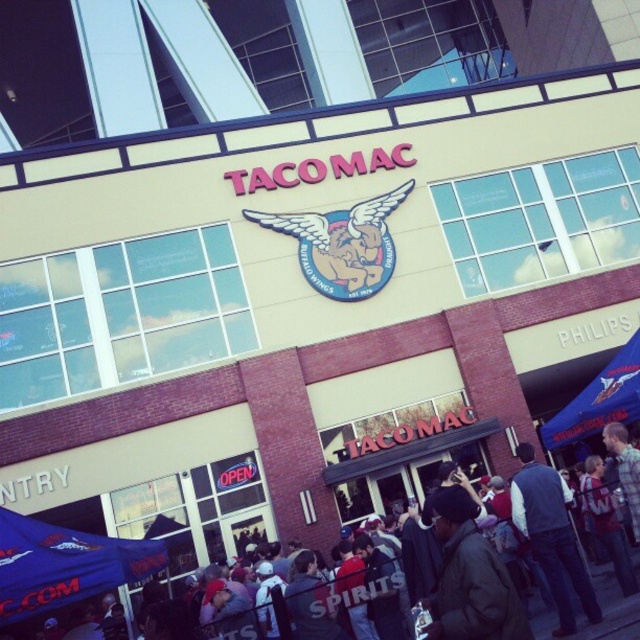
Does blue fabric canopy at lower left appear on the right side of dark gray jacket at center?

In fact, blue fabric canopy at lower left is to the left of dark gray jacket at center.

Who is positioned more to the right, blue fabric canopy at lower left or dark gray jacket at center?

dark gray jacket at center

Who is more forward, (109, 556) or (602, 632)?

Point (602, 632) is more forward.

I want to click on blue fabric canopy at lower left, so click(x=65, y=564).

Where is `blue fabric canopy at lower left`? The height and width of the screenshot is (640, 640). blue fabric canopy at lower left is located at coordinates (65, 564).

Does point (29, 563) come in front of point (528, 467)?

Yes, it is in front of point (528, 467).

Identify the location of blue fabric canopy at lower left. (65, 564).

Between point (60, 566) and point (529, 628), which one is positioned behind?

The point (60, 566) is behind.

Is blue fabric canopy at lower left positioned before dark brown jacket at center?

No, it is behind dark brown jacket at center.

What do you see at coordinates (65, 564) in the screenshot? The image size is (640, 640). I see `blue fabric canopy at lower left` at bounding box center [65, 564].

Locate an element on the screen. The width and height of the screenshot is (640, 640). blue fabric canopy at lower left is located at coordinates (65, 564).